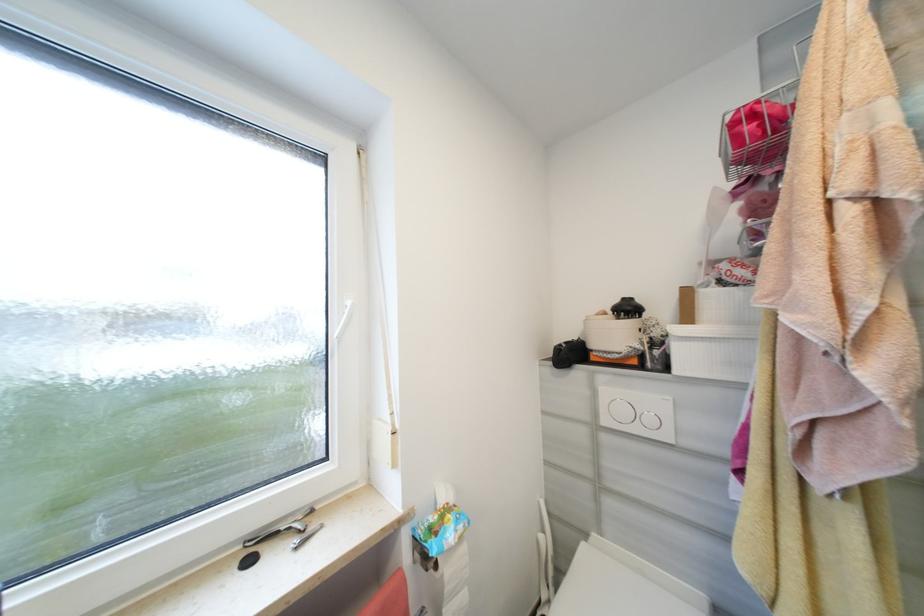
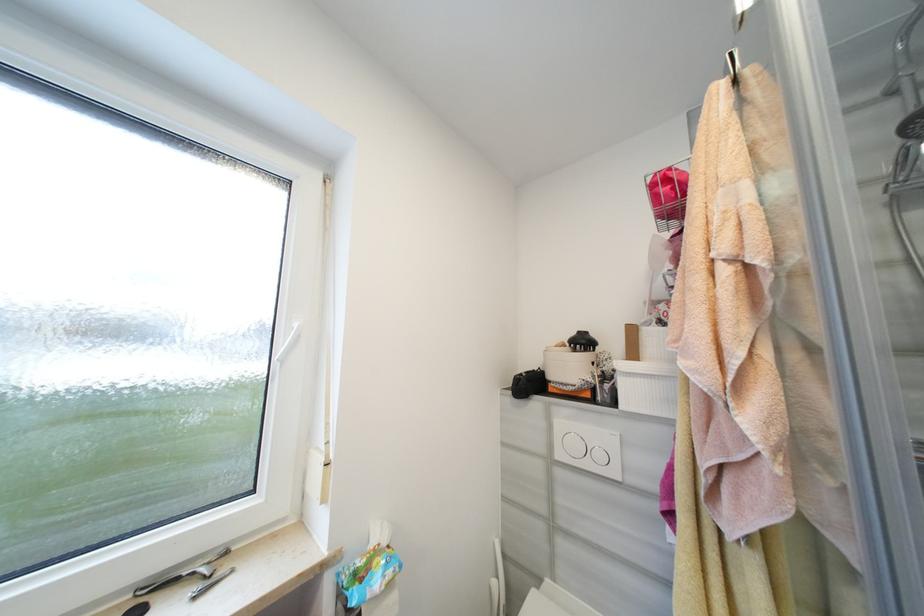
Question: The images are taken continuously from a first-person perspective. In which direction is your viewpoint rotating?

Choices:
 (A) Left
 (B) Right
 (C) Up
 (D) Down

Answer: (C)